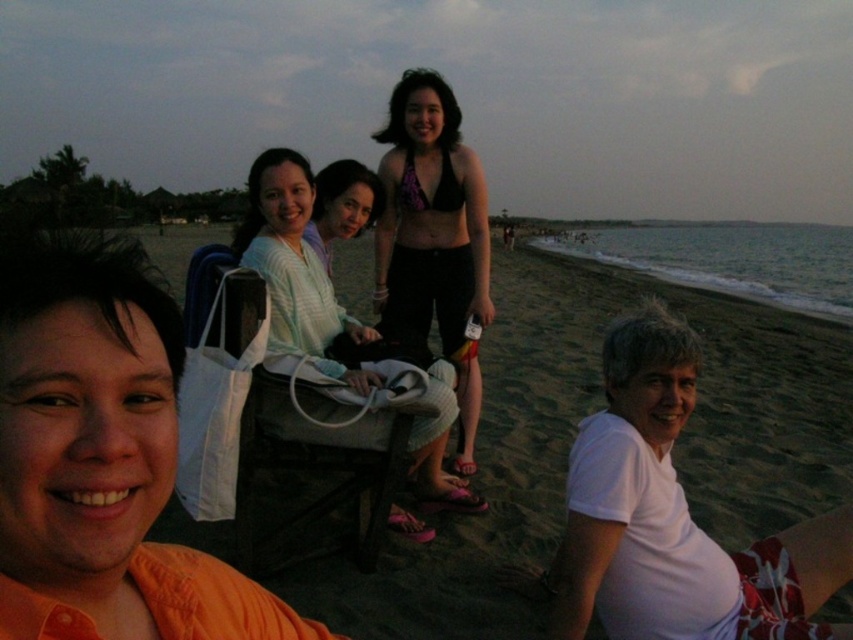
Is point (270, 480) more distant than point (281, 378)?

That is True.

Is point (548, 282) farther from camera compared to point (247, 312)?

That is True.

Where is `beige sand at lower center`? The width and height of the screenshot is (853, 640). beige sand at lower center is located at coordinates (573, 433).

Does white fabric beach chair at center have a larger size compared to light blue striped shirt at center?

No, white fabric beach chair at center is not bigger than light blue striped shirt at center.

Can you confirm if white fabric beach chair at center is positioned above light blue striped shirt at center?

No, white fabric beach chair at center is not above light blue striped shirt at center.

Where is `white fabric beach chair at center`? This screenshot has height=640, width=853. white fabric beach chair at center is located at coordinates (260, 422).

Is orange fabric shirt at left positioned at the back of purple fabric bikini top at center?

No, orange fabric shirt at left is closer to the viewer.

Is orange fabric shirt at left closer to the viewer compared to purple fabric bikini top at center?

That is True.

Image resolution: width=853 pixels, height=640 pixels. I want to click on orange fabric shirt at left, so click(x=102, y=460).